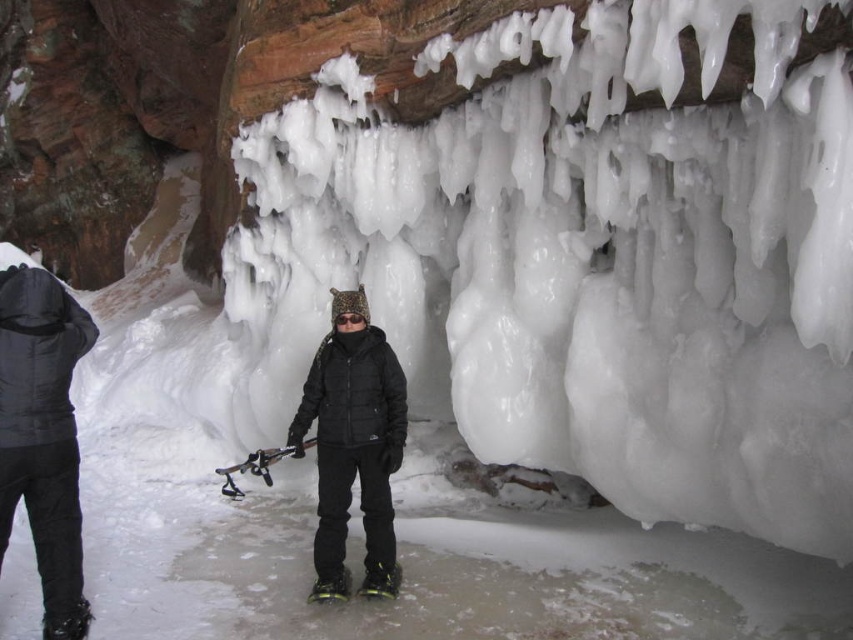
Between point (44, 593) and point (339, 476), which one is positioned in front?

Point (44, 593) is in front.

What are the coordinates of `black matte jacket at left` in the screenshot? It's located at (44, 435).